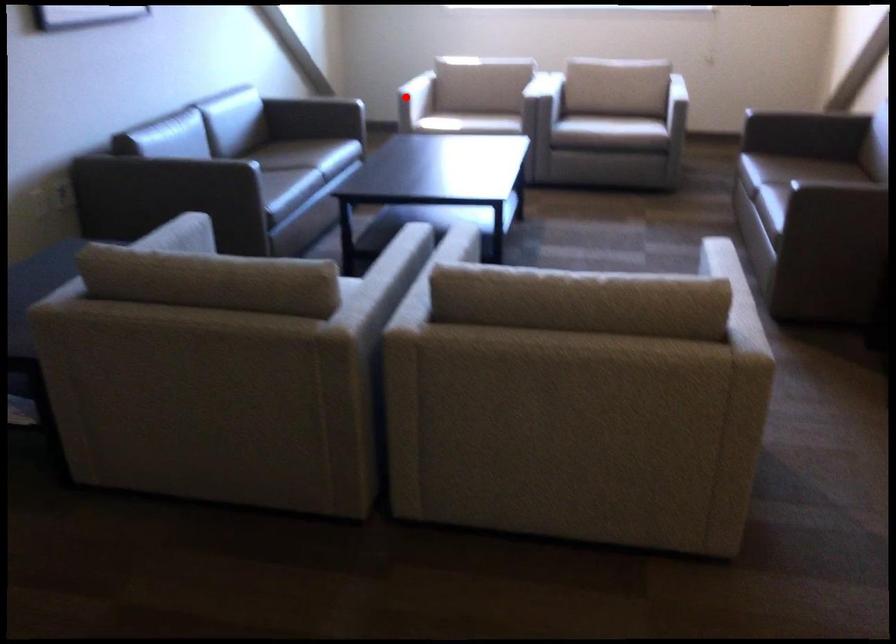
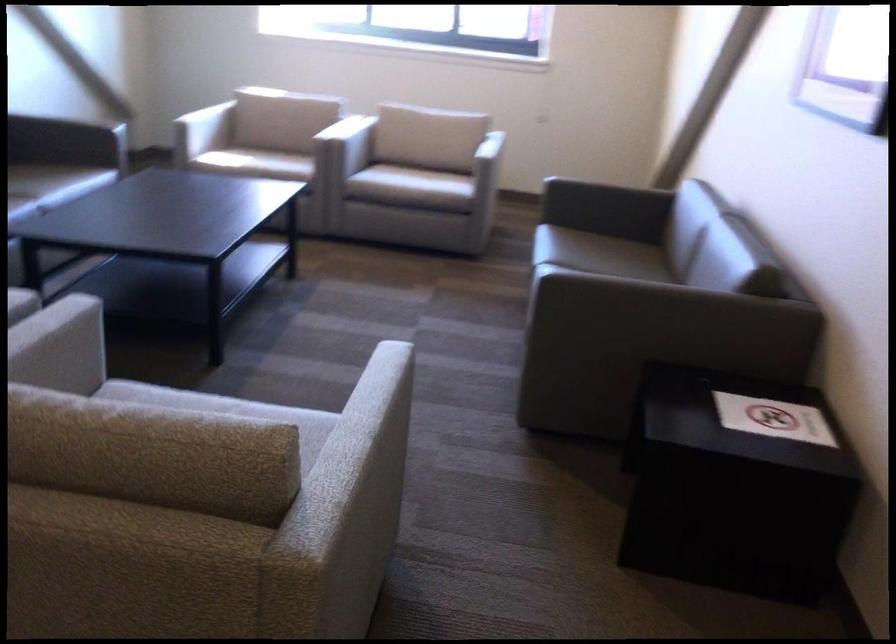
Locate, in the second image, the point that corresponds to the highlighted location in the first image.

(202, 131)